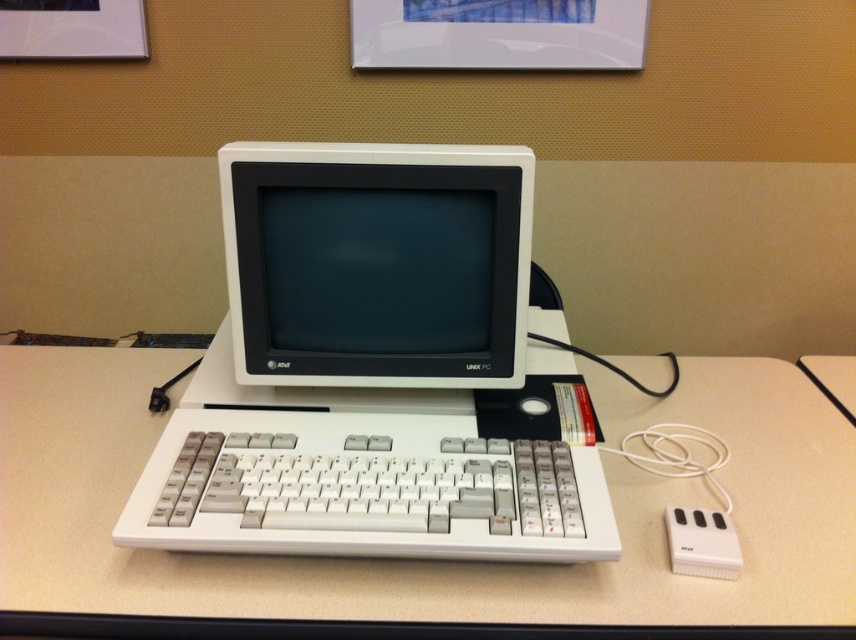
Identify the location of white plastic computer at center. click(x=376, y=371).

Can you confirm if white plastic computer at center is positioned below white plastic keyboard at center?

Incorrect, white plastic computer at center is not positioned below white plastic keyboard at center.

Identify the location of white plastic computer at center. (376, 371).

Between point (67, 515) and point (531, 534), which one is positioned in front?

Positioned in front is point (531, 534).

Who is more distant from viewer, (633, 504) or (180, 472)?

The point (633, 504) is behind.

The image size is (856, 640). What do you see at coordinates (421, 561) in the screenshot? I see `white plastic computer desk at center` at bounding box center [421, 561].

Image resolution: width=856 pixels, height=640 pixels. I want to click on white plastic computer desk at center, so click(421, 561).

Between point (281, 216) and point (324, 461), which one is positioned in front?

Point (324, 461)

Which is more to the left, white plastic monitor at center or white plastic keyboard at center?

white plastic keyboard at center is more to the left.

Which is behind, point (310, 282) or point (459, 508)?

Positioned behind is point (310, 282).

Locate an element on the screen. The height and width of the screenshot is (640, 856). white plastic monitor at center is located at coordinates [377, 262].